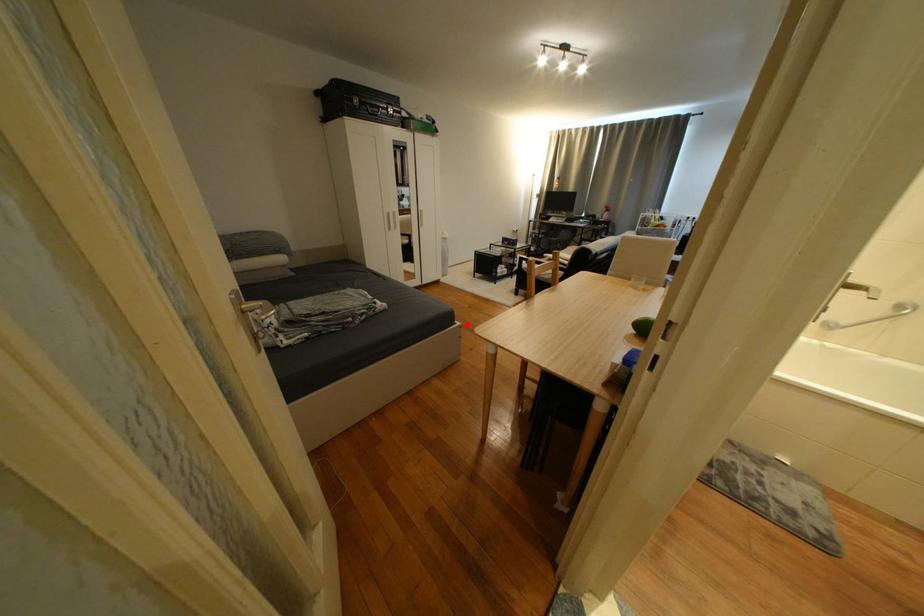
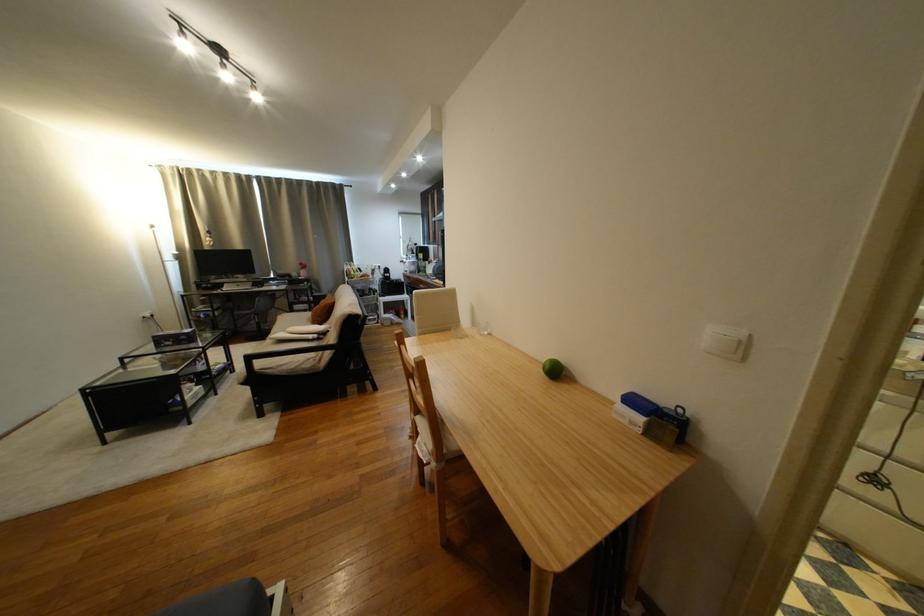
The point at the highlighted location is marked in the first image. Where is the corresponding point in the second image?

(286, 592)